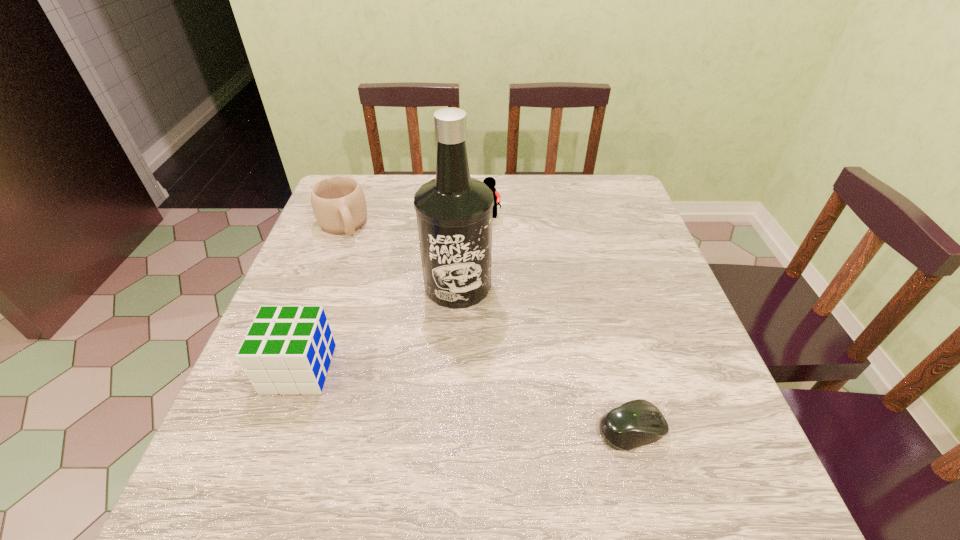
Identify the location of blank area located 0.140m on the side of the mug with the handle. This screenshot has height=540, width=960. (362, 273).

At what (x,y) coordinates should I click in order to perform the action: click on vacant space located on the front-facing side of the Lego. Please return your answer as a coordinate pair (x, y). This screenshot has width=960, height=540. Looking at the image, I should click on (465, 271).

Find the location of a particular element. free space located 0.290m on the front-facing side of the Lego is located at coordinates (456, 293).

The height and width of the screenshot is (540, 960). Identify the location of vacant area situated on the front-facing side of the Lego. (461, 281).

Where is `vacant space located 0.050m on the front label of the liquor`? This screenshot has width=960, height=540. vacant space located 0.050m on the front label of the liquor is located at coordinates (471, 326).

At what (x,y) coordinates should I click in order to perform the action: click on vacant point located on the front label of the liquor. Please return your answer as a coordinate pair (x, y). This screenshot has width=960, height=540. Looking at the image, I should click on (509, 435).

Identify the location of blank space located on the front label of the liquor. This screenshot has width=960, height=540. (500, 410).

This screenshot has width=960, height=540. I want to click on mug that is at the far edge, so click(x=338, y=202).

This screenshot has height=540, width=960. Identify the location of Lego that is at the far edge. (489, 181).

You are a GUI agent. You are given a task and a screenshot of the screen. Output one action in this format:
    pyautogui.click(x=<x>, y=<y>)
    Task: Click on the object at the near edge
    
    Given the screenshot: What is the action you would take?
    pyautogui.click(x=635, y=423)